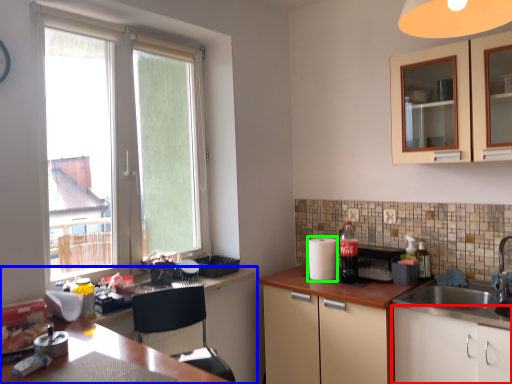
Question: Which object is positioned closest to cabinetry (highlighted by a red box)? Select from countertop (highlighted by a blue box) and appliance (highlighted by a green box).

Choices:
 (A) countertop
 (B) appliance

Answer: (B)